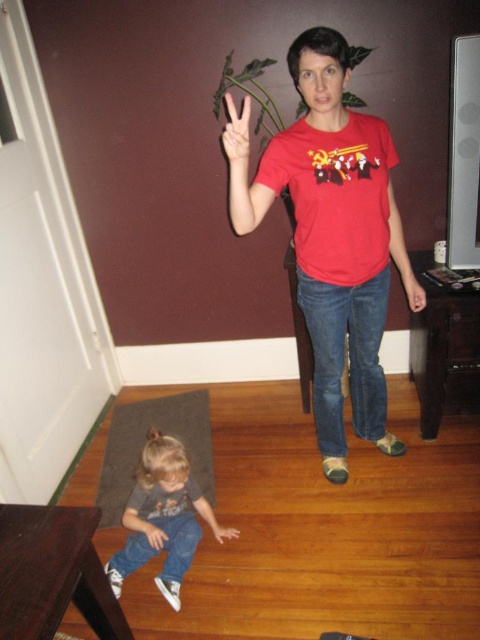
How far apart are matte skin hand at center and smooth skin hand at lower center?

They are 3.53 feet apart.

Based on the photo, does matte skin hand at center appear on the right side of smooth skin hand at lower center?

Yes, matte skin hand at center is to the right of smooth skin hand at lower center.

What do you see at coordinates (412, 291) in the screenshot? This screenshot has width=480, height=640. I see `matte skin hand at center` at bounding box center [412, 291].

I want to click on matte skin hand at center, so click(x=412, y=291).

Does smooth skin hand at lower left have a smaller size compared to smooth skin hand at lower center?

No.

Between smooth skin hand at lower left and smooth skin hand at lower center, which one is positioned lower?

smooth skin hand at lower center is below.

What do you see at coordinates (155, 536) in the screenshot? I see `smooth skin hand at lower left` at bounding box center [155, 536].

Locate an element on the screen. The width and height of the screenshot is (480, 640). smooth skin hand at lower left is located at coordinates (155, 536).

Who is higher up, brown carpet at lower left or smooth skin hand at lower left?

brown carpet at lower left is higher up.

Looking at this image, who is more forward, (172, 400) or (164, 536)?

Point (164, 536) is more forward.

The width and height of the screenshot is (480, 640). I want to click on brown carpet at lower left, so click(144, 442).